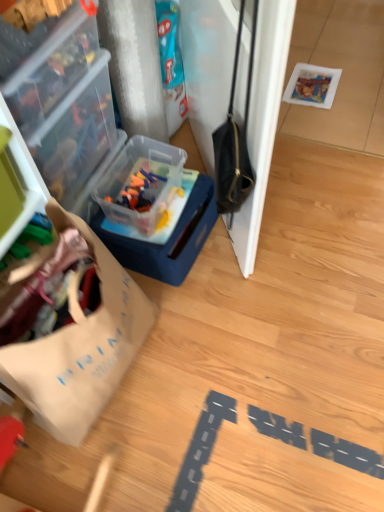
In order to click on free point to the right of translucent plastic container at center-left, which appears as the 1th box when viewed from the right in this screenshot , I will do `click(268, 245)`.